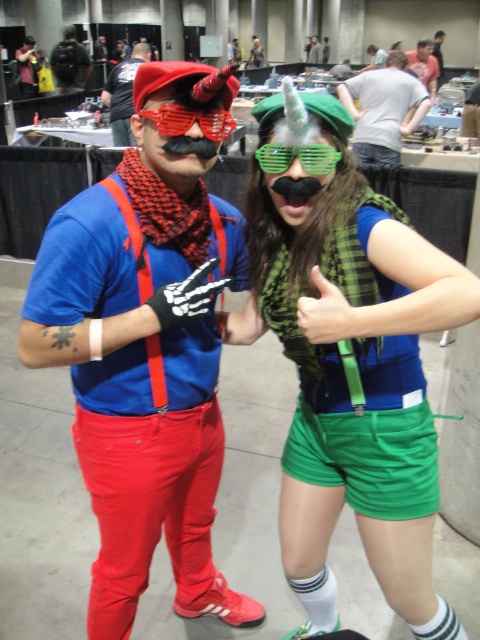
Does green fabric shirt at center appear on the left side of translucent red plastic goggles at center?

Incorrect, green fabric shirt at center is not on the left side of translucent red plastic goggles at center.

Locate an element on the screen. The width and height of the screenshot is (480, 640). green fabric shirt at center is located at coordinates (384, 108).

Who is positioned more to the left, green fabric shirt at center or matte red suspenders at center?

Positioned to the left is matte red suspenders at center.

This screenshot has width=480, height=640. Describe the element at coordinates (384, 108) in the screenshot. I see `green fabric shirt at center` at that location.

Is point (399, 138) farther from camera compared to point (134, 67)?

No, it is in front of (134, 67).

You are a GUI agent. You are given a task and a screenshot of the screen. Output one action in this format:
    pyautogui.click(x=<x>, y=<y>)
    Task: Click on the green fabric shirt at center
    Image resolution: width=480 pixels, height=640 pixels.
    Given the screenshot: What is the action you would take?
    pyautogui.click(x=384, y=108)

Does green matte vest at center have a lesser width compared to green plastic goggles at center?

In fact, green matte vest at center might be wider than green plastic goggles at center.

Between green matte vest at center and green plastic goggles at center, which one has less height?

green plastic goggles at center is shorter.

Describe the element at coordinates (351, 356) in the screenshot. I see `green matte vest at center` at that location.

Where is `green matte vest at center`? This screenshot has width=480, height=640. green matte vest at center is located at coordinates (351, 356).